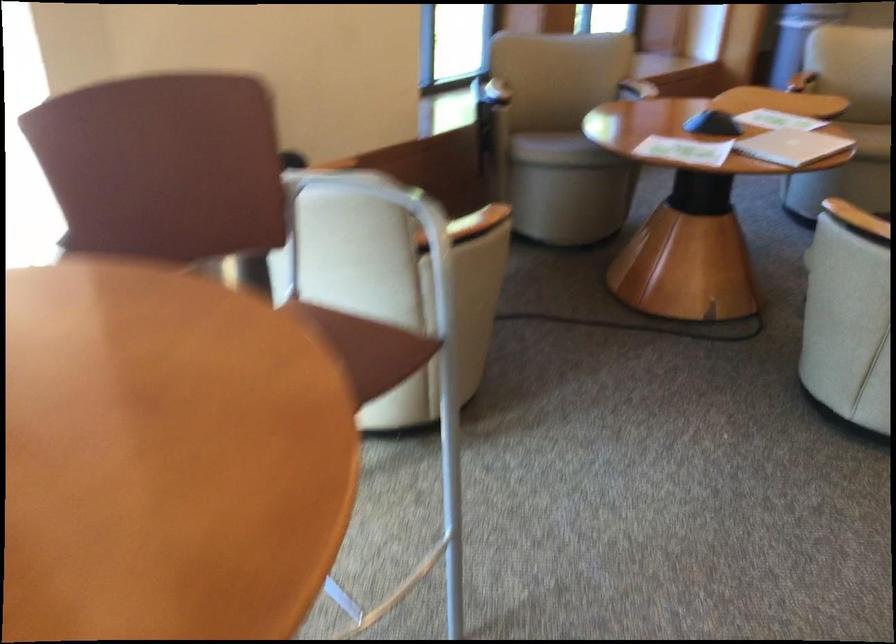
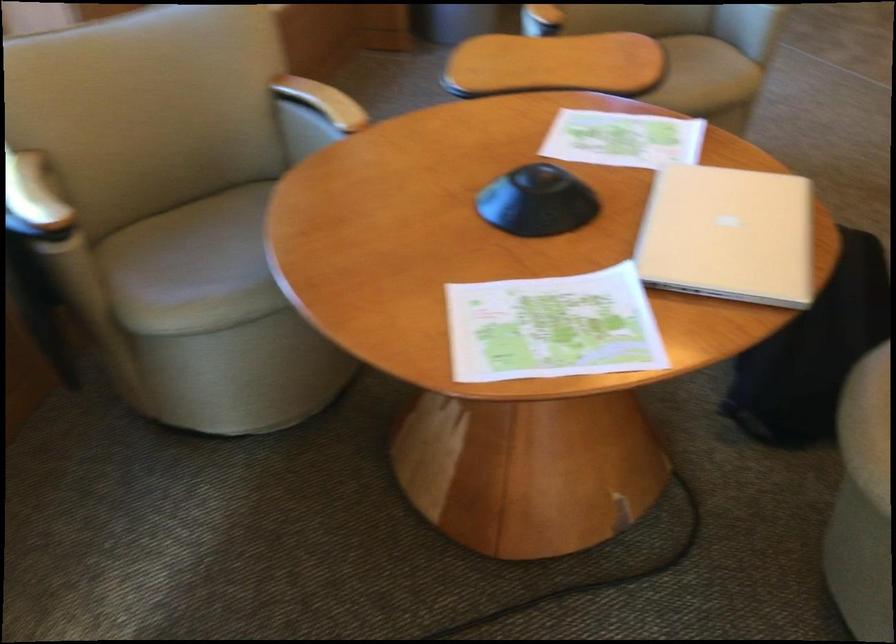
Locate, in the second image, the point that corresponds to the point at 798,111 in the first image.

(623, 138)